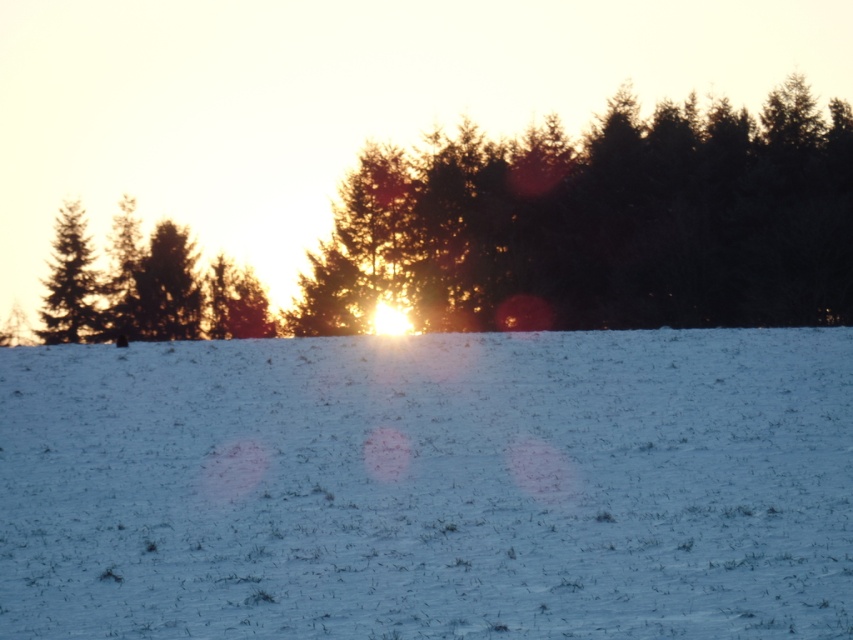
Is white matte snow at center to the right of green matte tree at left from the viewer's perspective?

Correct, you'll find white matte snow at center to the right of green matte tree at left.

Does white matte snow at center appear under green matte tree at left?

Yes, white matte snow at center is below green matte tree at left.

Who is more forward, (614, 602) or (54, 269)?

Point (614, 602) is in front.

Locate an element on the screen. The image size is (853, 640). white matte snow at center is located at coordinates (x=430, y=486).

Who is positioned more to the left, white matte snow at center or silvery metallic trees at center?

white matte snow at center

Is white matte snow at center bigger than silvery metallic trees at center?

Incorrect, white matte snow at center is not larger than silvery metallic trees at center.

Which is behind, point (258, 433) or point (392, 218)?

The point (392, 218) is more distant.

This screenshot has width=853, height=640. What are the coordinates of `white matte snow at center` in the screenshot? It's located at (x=430, y=486).

Does silvery metallic trees at center have a greater height compared to green matte tree at left?

Indeed, silvery metallic trees at center has a greater height compared to green matte tree at left.

Does point (292, 321) come in front of point (65, 337)?

Yes, point (292, 321) is in front of point (65, 337).

Identify the location of silvery metallic trees at center. (601, 225).